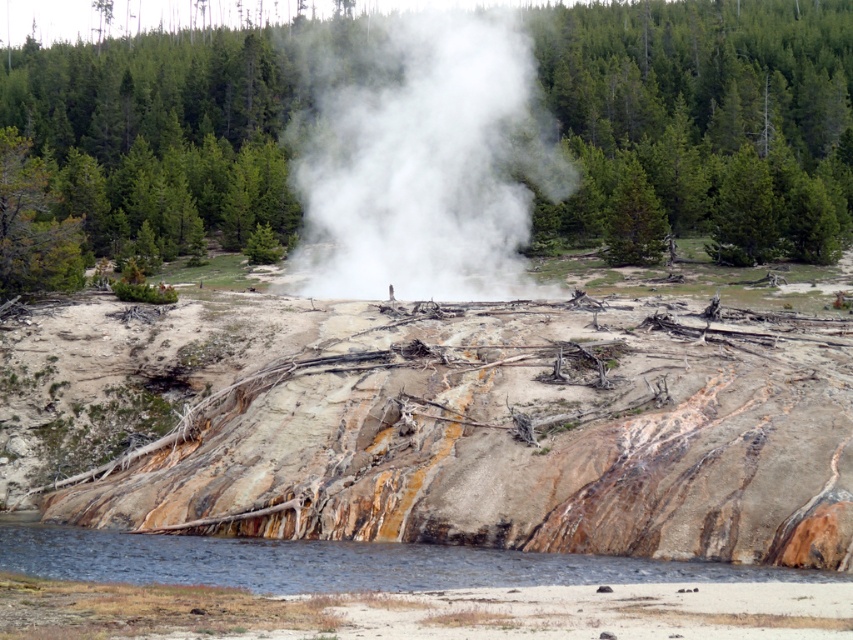
In the scene shown: Can you confirm if green leafy tree at center is bigger than clear water at lower left?

Yes, green leafy tree at center is bigger than clear water at lower left.

Is point (686, 102) more distant than point (312, 556)?

Yes, point (686, 102) is farther from viewer.

Where is `green leafy tree at center`? green leafy tree at center is located at coordinates (700, 125).

Is the position of white vapor at center more distant than that of clear water at lower left?

Yes, it is.

Can you confirm if white vapor at center is positioned to the left of clear water at lower left?

Correct, you'll find white vapor at center to the left of clear water at lower left.

This screenshot has width=853, height=640. In order to click on white vapor at center in this screenshot , I will do (426, 168).

Is point (83, 160) in front of point (532, 172)?

No, (83, 160) is further to viewer.

Can you confirm if green leafy tree at center is taller than white vapor at center?

Yes.

Who is more distant from viewer, (614, 36) or (347, 176)?

Positioned behind is point (614, 36).

At what (x,y) coordinates should I click in order to perform the action: click on green leafy tree at center. Please return your answer as a coordinate pair (x, y). This screenshot has width=853, height=640. Looking at the image, I should click on (700, 125).